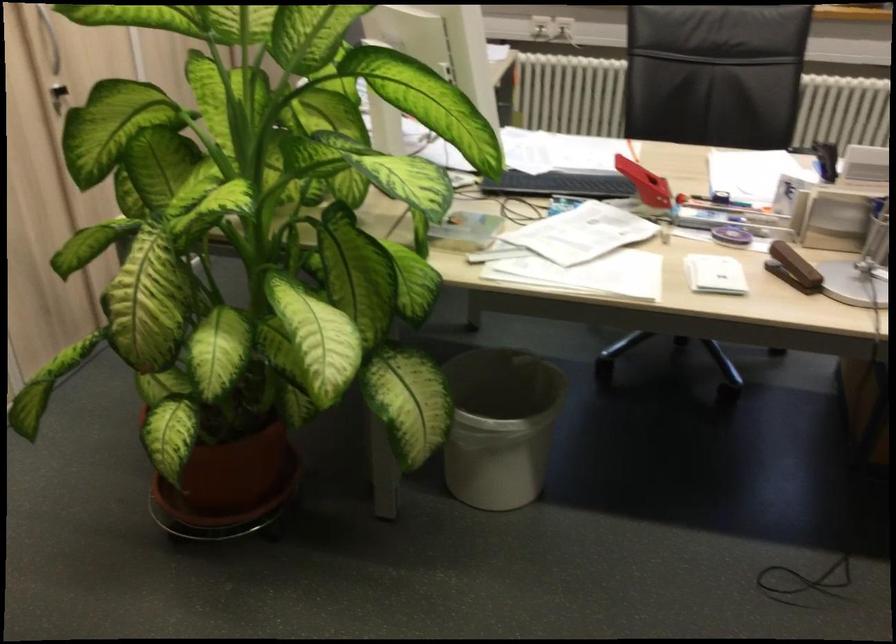
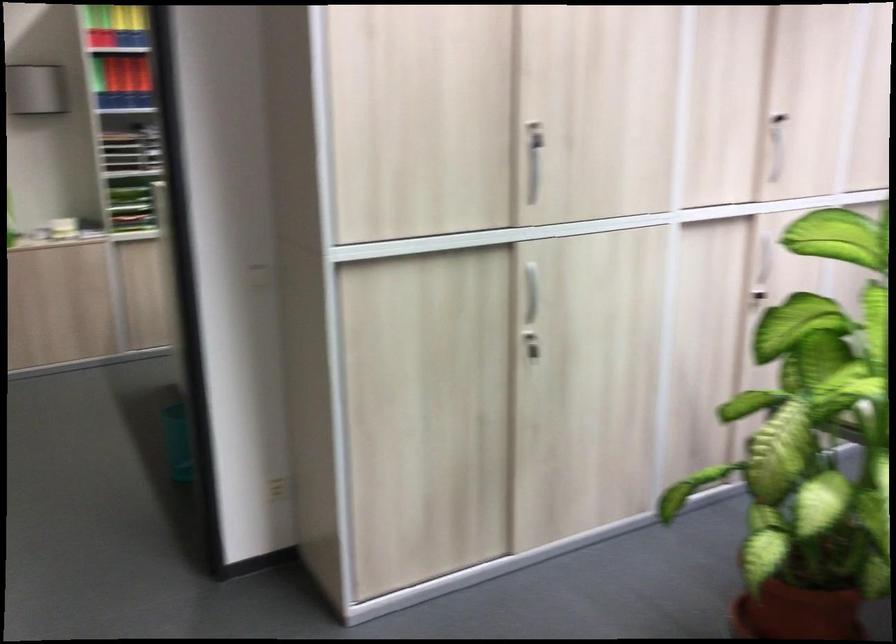
The point at (229, 473) is marked in the first image. Where is the corresponding point in the second image?

(797, 612)